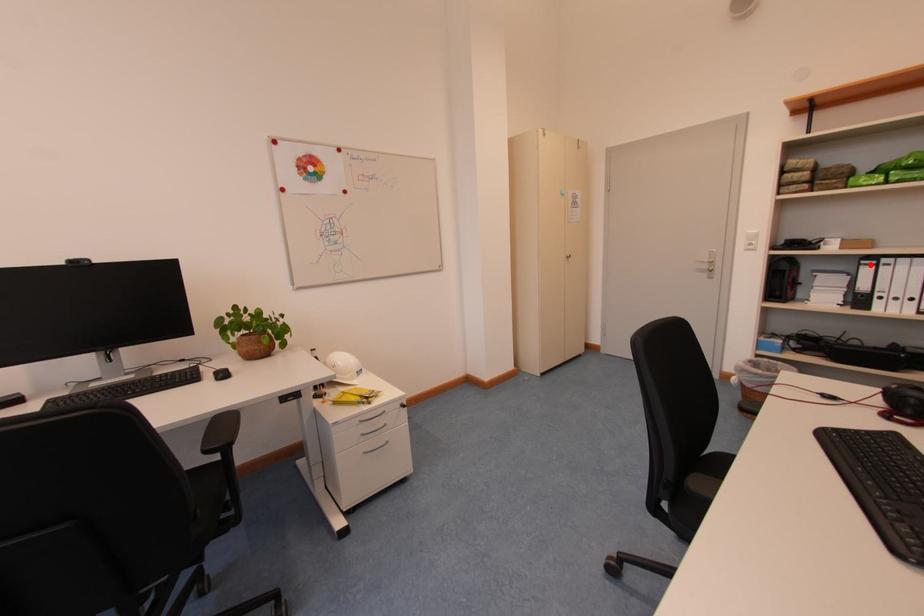
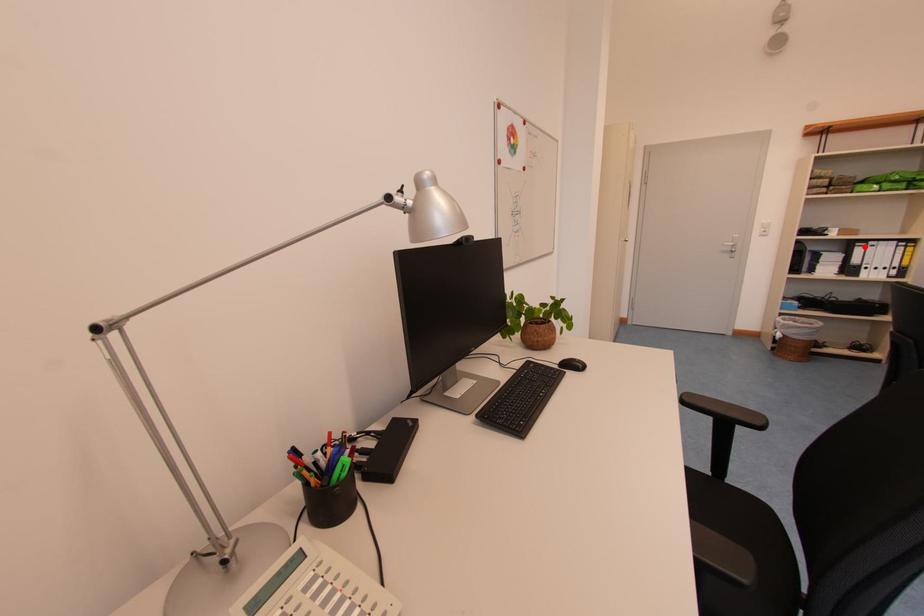
I am providing you with two images of the same scene from different viewpoints. A red point is marked on the first image and another point is marked on the second image. Do the highlighted points in image1 and image2 indicate the same real-world spot?

Yes